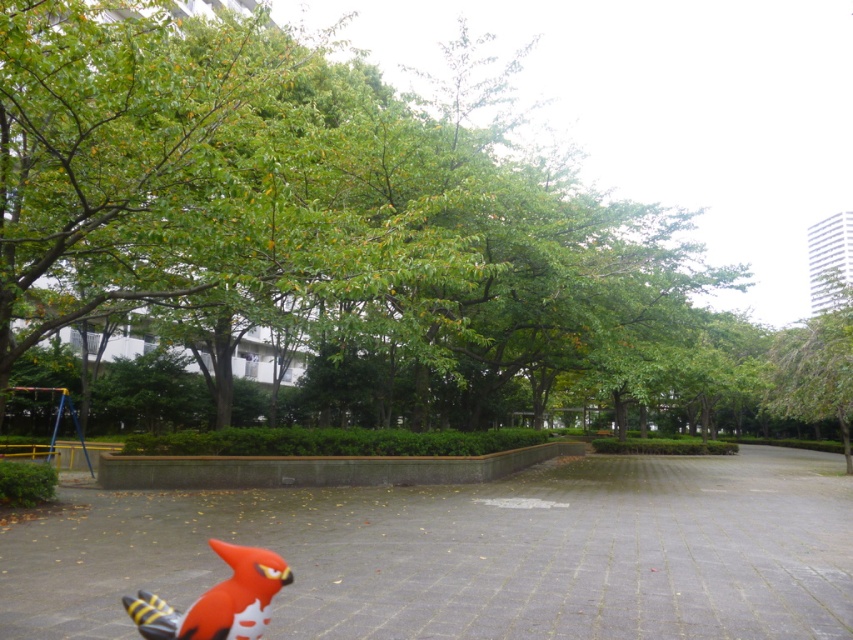
Question: Is green leafy tree at upper right below rubberized red bird at lower center?

Choices:
 (A) yes
 (B) no

Answer: (A)

Question: Which point appears closest to the camera in this image?

Choices:
 (A) (122, 515)
 (B) (805, 326)
 (C) (160, 627)

Answer: (C)

Question: Can you confirm if green leafy tree at center is positioned below smooth concrete path at center?

Choices:
 (A) no
 (B) yes

Answer: (A)

Question: Among these objects, which one is farthest from the camera?

Choices:
 (A) rubberized red bird at lower center
 (B) green leafy tree at center
 (C) smooth concrete path at center

Answer: (B)

Question: Is green leafy tree at center smaller than smooth concrete path at center?

Choices:
 (A) yes
 (B) no

Answer: (B)

Question: Which point is farther to the camera?

Choices:
 (A) green leafy tree at center
 (B) green leafy tree at upper right
 (C) smooth concrete path at center
 (D) rubberized red bird at lower center

Answer: (B)